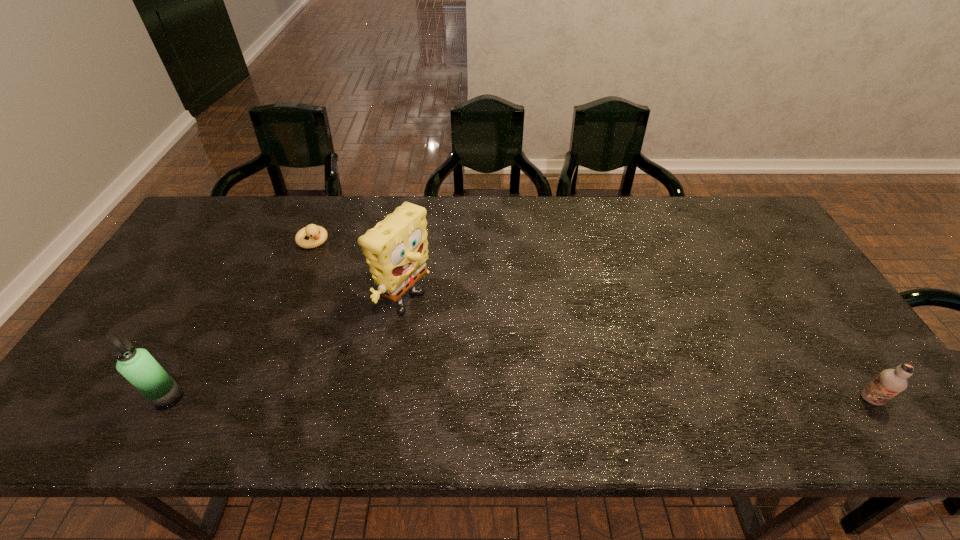
At what (x,y) coordinates should I click in order to perform the action: click on free space on the desktop that is between the third shortest object and the chocolate milk and is positioned on the face of the tallest object. Please return your answer as a coordinate pair (x, y). The height and width of the screenshot is (540, 960). Looking at the image, I should click on (575, 399).

Identify the location of free spot on the desktop that is between the thermos bottle and the chocolate milk and is positioned at the beak of the second object from left to right. (462, 399).